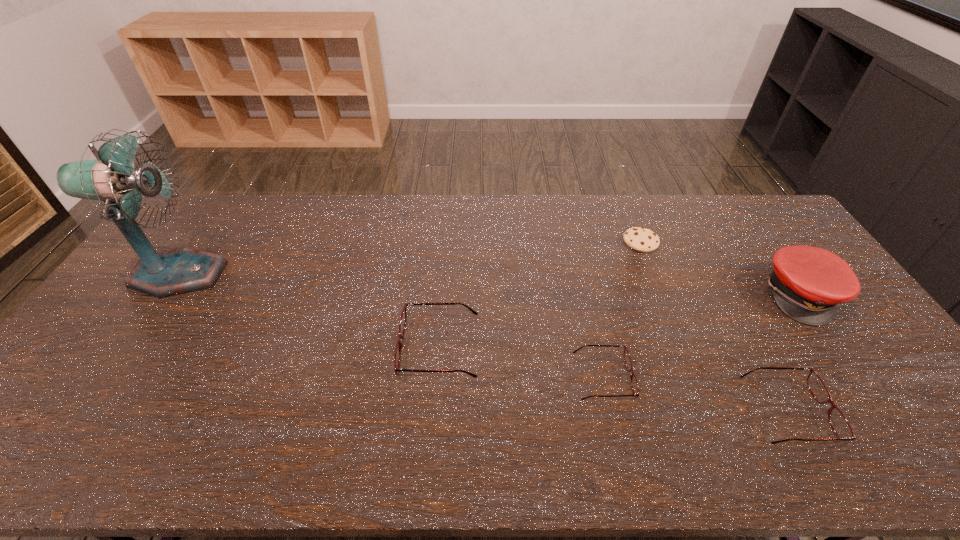
This screenshot has height=540, width=960. I want to click on the fifth object from right to left, so click(403, 318).

This screenshot has width=960, height=540. In order to click on the tallest spectacles in this screenshot , I will do `click(403, 318)`.

The width and height of the screenshot is (960, 540). Find the location of `the fourth object from right to left`. the fourth object from right to left is located at coordinates (634, 383).

What are the coordinates of `the shortest spectacles` in the screenshot? It's located at 634,383.

This screenshot has height=540, width=960. I want to click on the second object from right to left, so 838,421.

You are a GUI agent. You are given a task and a screenshot of the screen. Output one action in this format:
    pyautogui.click(x=<x>, y=<y>)
    Task: Click on the second tallest spectacles
    This screenshot has height=540, width=960.
    Given the screenshot: What is the action you would take?
    [x=838, y=421]

Where is `the fourth object from left to right`? Image resolution: width=960 pixels, height=540 pixels. the fourth object from left to right is located at coordinates (644, 240).

The width and height of the screenshot is (960, 540). What are the coordinates of `the leftmost object` in the screenshot? It's located at (111, 177).

Where is `the tallest object`? The height and width of the screenshot is (540, 960). the tallest object is located at coordinates (111, 177).

In order to click on the rightmost object in this screenshot , I will do [807, 283].